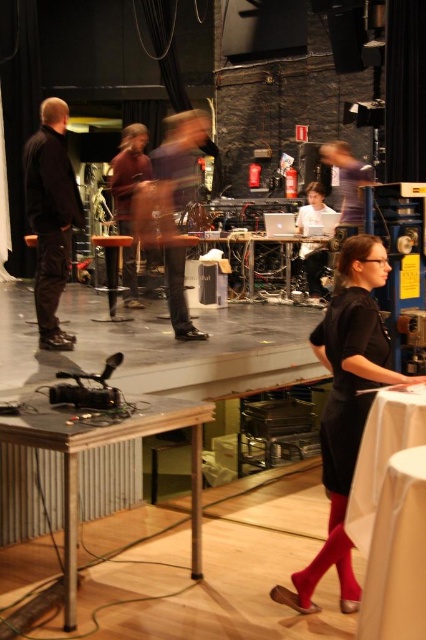
Question: From the image, what is the correct spatial relationship of wooden table at lower left in relation to brown leather jacket at center?

Choices:
 (A) below
 (B) above

Answer: (A)

Question: Which object is closer to the camera taking this photo?

Choices:
 (A) dark brown leather shoes at center
 (B) white cloth at lower right
 (C) wooden table at lower left
 (D) black matte dress at lower right

Answer: (B)

Question: Does black matte dress at lower right have a lesser width compared to dark brown leather pants at left?

Choices:
 (A) yes
 (B) no

Answer: (B)

Question: Which object is positioned closest to the black matte dress at lower right?

Choices:
 (A) dark brown leather pants at left
 (B) dark brown leather shoes at center
 (C) wooden table at lower left
 (D) white cloth at lower right

Answer: (D)

Question: Which object appears farthest from the camera in this image?

Choices:
 (A) white cloth at lower right
 (B) black matte dress at lower right

Answer: (B)

Question: Is wooden table at lower left bigger than dark brown leather shoes at center?

Choices:
 (A) no
 (B) yes

Answer: (B)